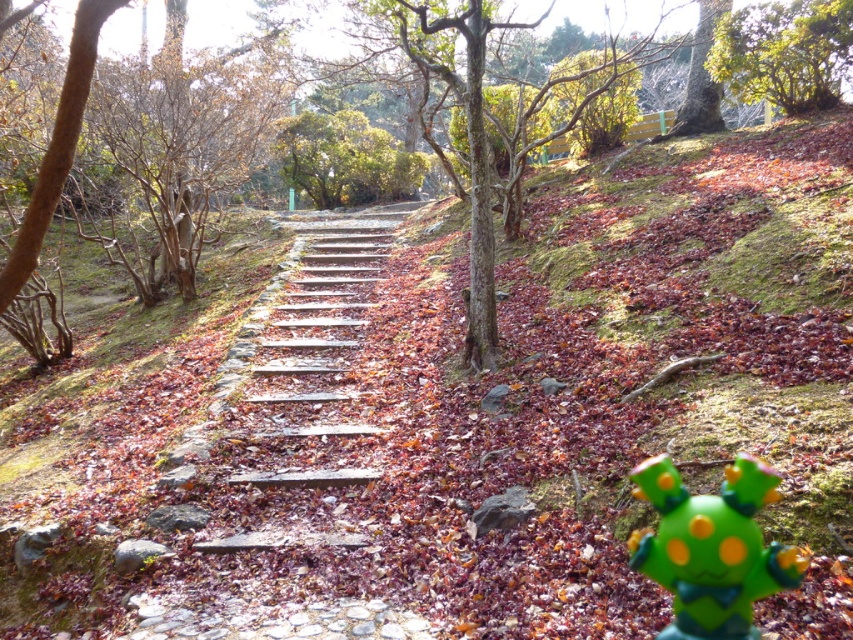
You are a child playing in the autumn scene. You have a green matte toy at lower right and see a green leafy tree at upper right. Which object is wider?

The green leafy tree at upper right is wider than the green matte toy at lower right.

You are standing at point (711, 548) in the scene. What object is located at your current position?

The green matte toy at lower right is located at point (711, 548).

You are a child playing in the autumn scene. You see the wooden steps at center and the green matte toy at lower right. Which object is located more to the left side of the scene?

The wooden steps at center is positioned on the left side of green matte toy at lower right, so the wooden steps at center is more to the left.